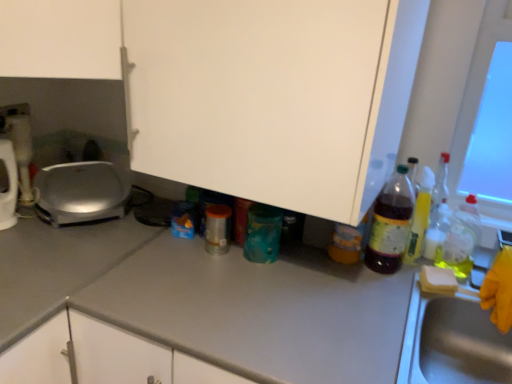
Question: Relative to gray matte countertop at center, is gray matte countertop at center in front or behind?

Choices:
 (A) behind
 (B) front

Answer: (B)

Question: Is gray matte countertop at center inside or outside of gray matte countertop at center?

Choices:
 (A) inside
 (B) outside

Answer: (B)

Question: Based on their relative distances, which object is nearer to the white matte cabinet at center?

Choices:
 (A) translucent plastic bottle at right, the 5th bottle in the left-to-right sequence
 (B) gray matte countertop at center
 (C) translucent plastic bottle at right, which is the 3th bottle from right to left
 (D) translucent plastic bottle at right, positioned as the fourth bottle in left-to-right order
 (E) metallic silver toaster at left, the second appliance viewed from the left

Answer: (C)

Question: Which object is positioned closest to the translucent plastic bottle at right, the 1th bottle when ordered from right to left?

Choices:
 (A) metallic silver can at center, the fifth bottle viewed from the right
 (B) metallic silver toaster at left, the second appliance viewed from the left
 (C) translucent plastic bottle at right, the 2th bottle in the right-to-left sequence
 (D) gray matte countertop at center
 (E) metallic stainless steel sink at right

Answer: (C)